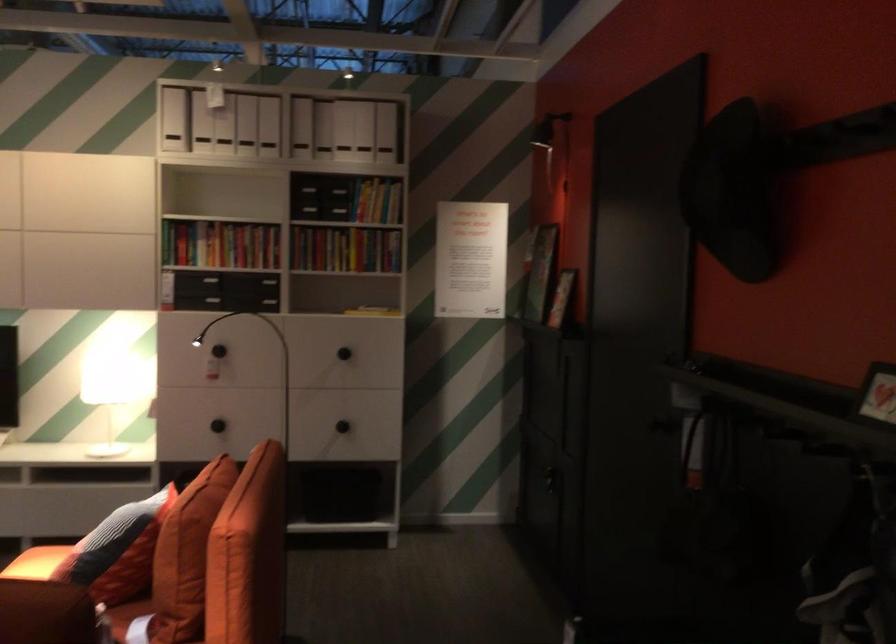
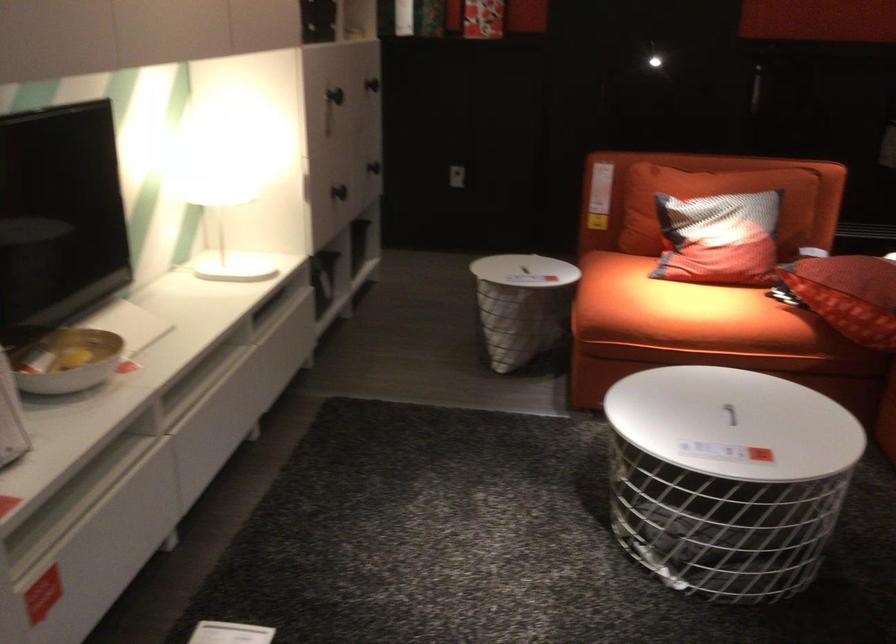
Find the pixel in the second image that matches pixel 83 389 in the first image.

(199, 198)